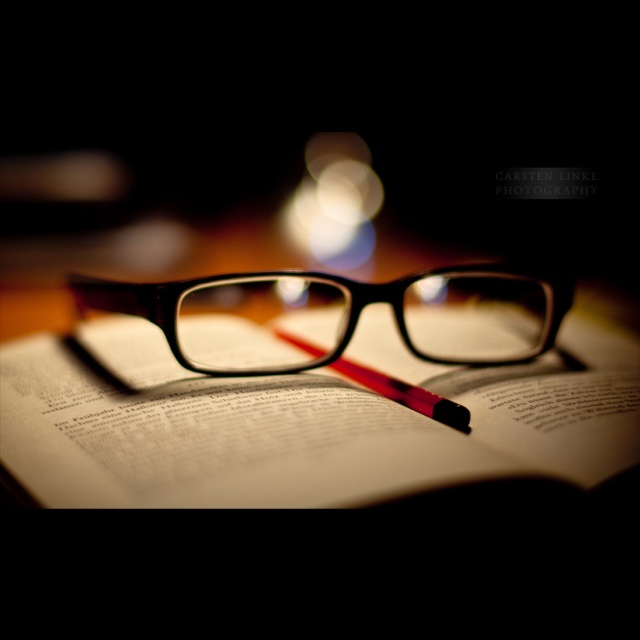
You are organizing a study area and need to place a new item on the desk. The paper book at center is currently occupying space at coordinates 0.659, 0.472. If you want to place a new item without overlapping it, where should you position it?

The paper book at center is located at point (301, 420). To avoid overlapping, place the new item at a different coordinate such as (320, 192) or (128, 512).

You are organizing a desk and need to stack the paper book at center and the red rubberized pencil at center vertically. Which object should you place at the bottom to ensure stability?

The paper book at center should be placed at the bottom because it has a greater height than the red rubberized pencil at center, providing a more stable base.

You are a student trying to place your black plastic glasses at center on top of the paper book at center. Will the glasses fit entirely on the book without hanging off the edges?

The paper book at center is much taller than the black plastic glasses at center, so the glasses will fit entirely on the book without hanging off the edges.